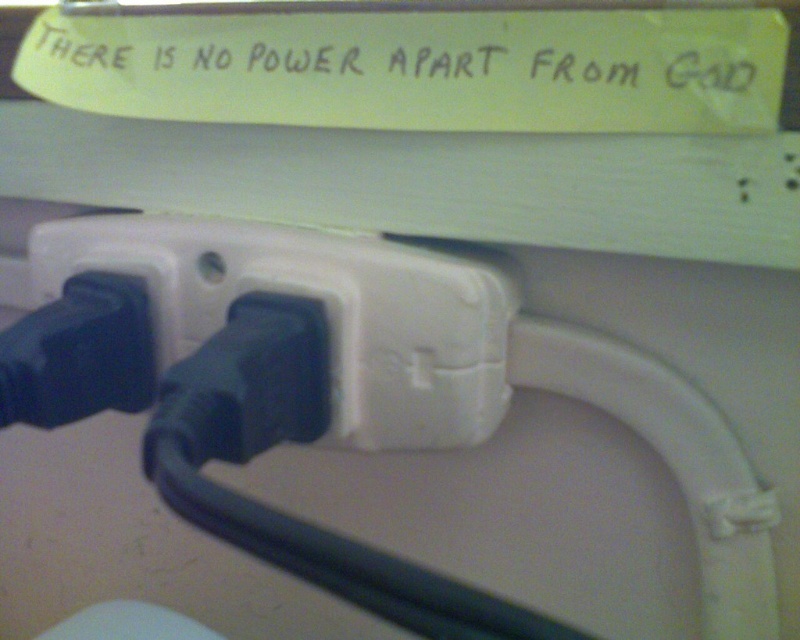
Question: Is white plastic power outlet at center closer to camera compared to yellow paper at upper center?

Choices:
 (A) no
 (B) yes

Answer: (A)

Question: Which point is farther from the camera taking this photo?

Choices:
 (A) (462, 337)
 (B) (408, 49)

Answer: (B)

Question: Where is white plastic power outlet at center located in relation to yellow paper at upper center in the image?

Choices:
 (A) above
 (B) below

Answer: (B)

Question: Which object appears closest to the camera in this image?

Choices:
 (A) yellow paper at upper center
 (B) white plastic power outlet at center

Answer: (A)

Question: Can you confirm if white plastic power outlet at center is positioned below yellow paper at upper center?

Choices:
 (A) no
 (B) yes

Answer: (B)